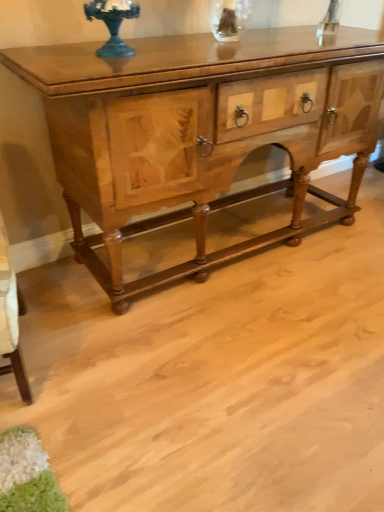
Find the location of a particular element. Image resolution: width=384 pixels, height=512 pixels. wooden cabinet at center is located at coordinates (198, 132).

What do you see at coordinates (198, 132) in the screenshot? The image size is (384, 512). I see `wooden cabinet at center` at bounding box center [198, 132].

You are a GUI agent. You are given a task and a screenshot of the screen. Output one action in this format:
    pyautogui.click(x=<x>, y=<y>)
    Task: Click on the wooden cabinet at center
    The image size is (384, 512).
    Given the screenshot: What is the action you would take?
    pyautogui.click(x=198, y=132)